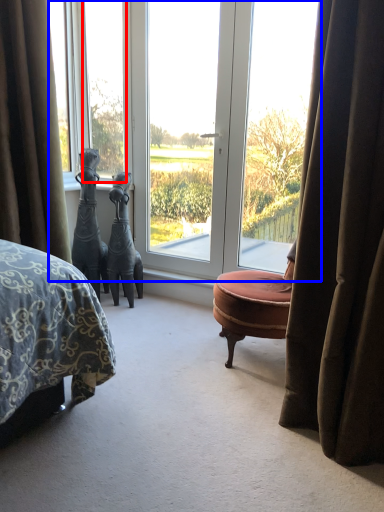
Question: Which object appears farthest to the camera in this image, window (highlighted by a red box) or window (highlighted by a blue box)?

Choices:
 (A) window
 (B) window

Answer: (A)